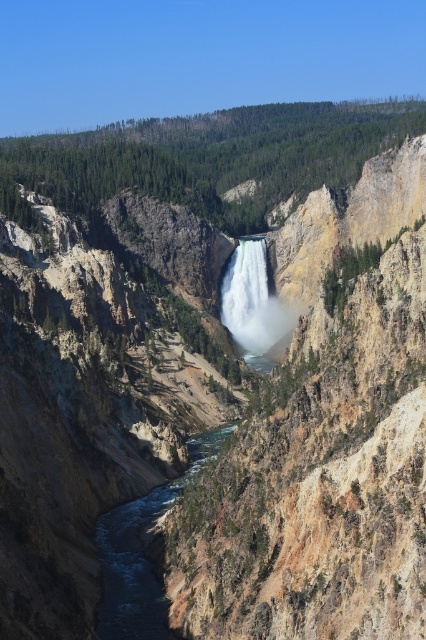
Question: Does clear water at center appear on the left side of white smooth waterfall at center?

Choices:
 (A) no
 (B) yes

Answer: (B)

Question: Can you confirm if clear water at center is positioned to the left of white smooth waterfall at center?

Choices:
 (A) yes
 (B) no

Answer: (A)

Question: Which point is farther to the camera?

Choices:
 (A) clear water at center
 (B) white smooth waterfall at center

Answer: (B)

Question: Can you confirm if clear water at center is positioned to the left of white smooth waterfall at center?

Choices:
 (A) no
 (B) yes

Answer: (B)